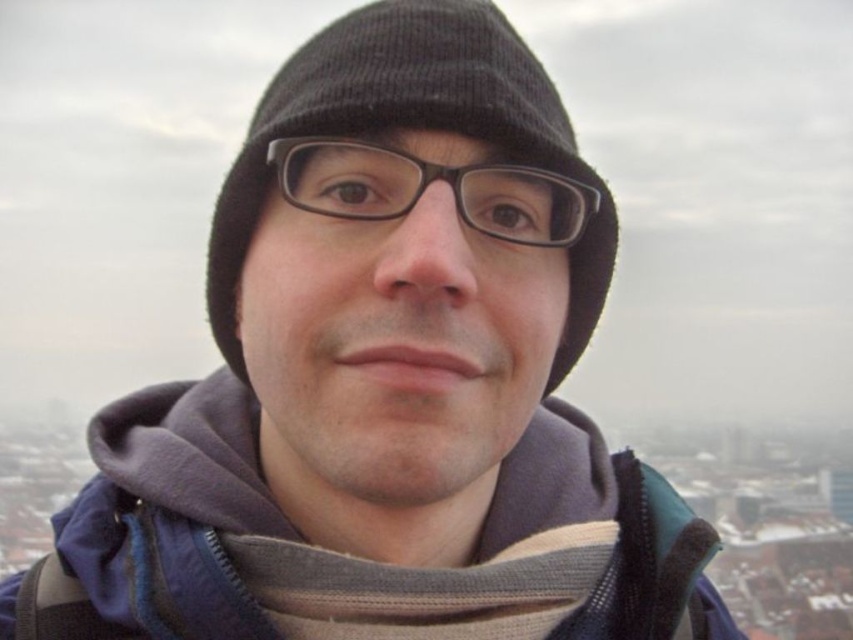
Question: Is navy blue fleece jacket at center bigger than black knit hat at center?

Choices:
 (A) yes
 (B) no

Answer: (A)

Question: Is navy blue fleece jacket at center above black knit hat at center?

Choices:
 (A) yes
 (B) no

Answer: (B)

Question: From the image, what is the correct spatial relationship of navy blue fleece jacket at center in relation to black knit hat at center?

Choices:
 (A) above
 (B) below

Answer: (B)